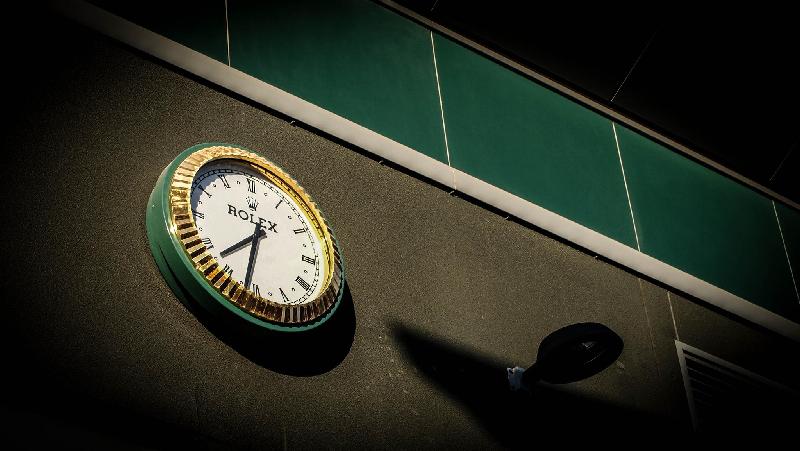
This screenshot has width=800, height=451. I want to click on analog clock, so click(281, 250).